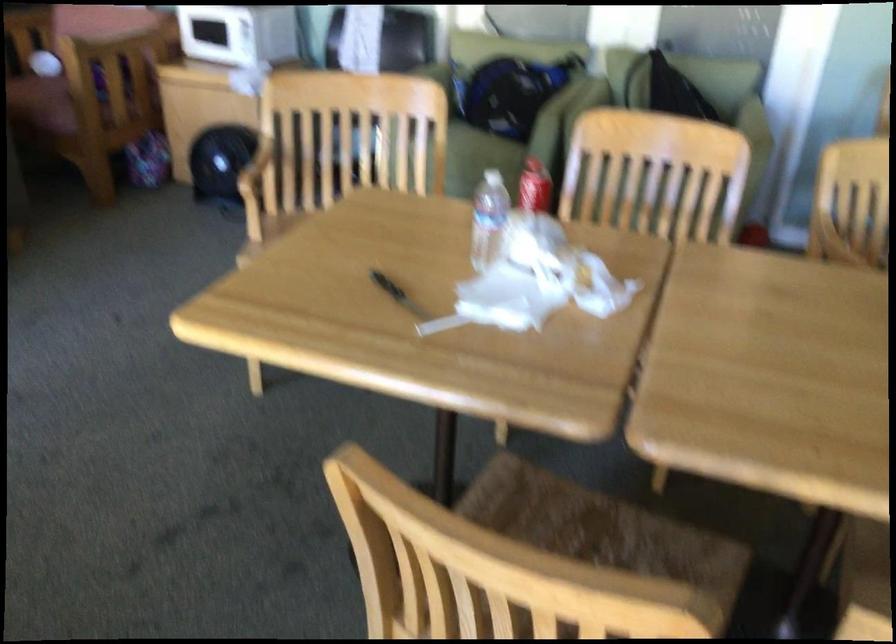
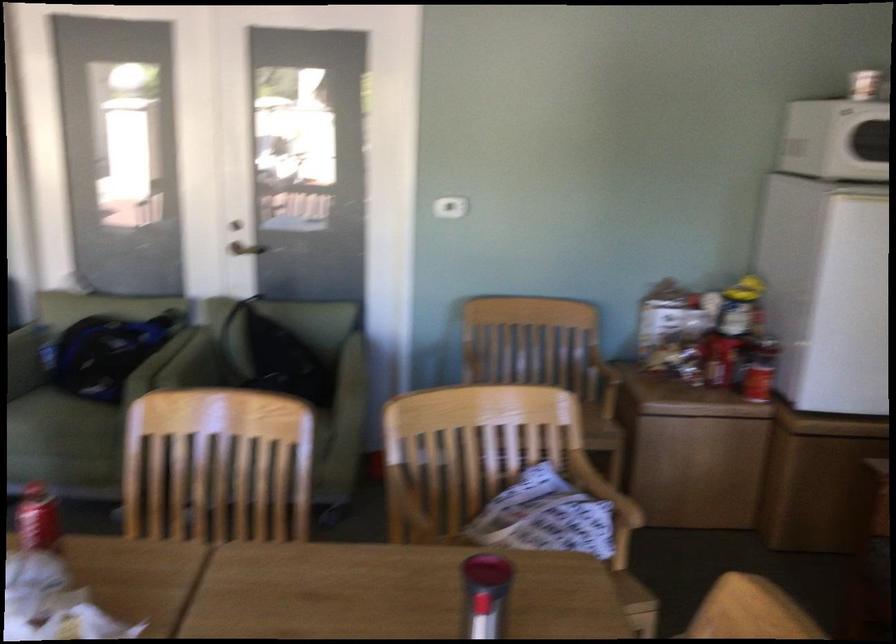
Question: I am providing you with two images of the same scene from different viewpoints. After the viewpoint changes to image2, which objects are now occluded?

Choices:
 (A) metal door handle
 (B) wooden cabinet lid
 (C) small white can
 (D) none of these

Answer: (D)